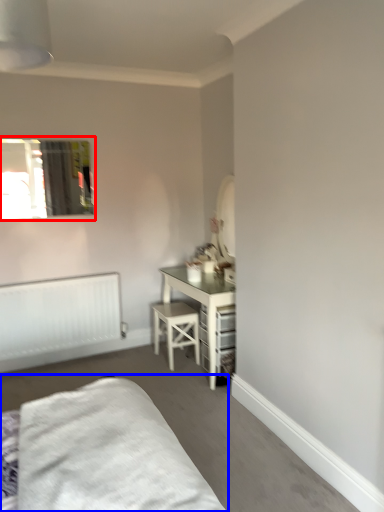
Question: Among these objects, which one is farthest to the camera, window (highlighted by a red box) or bed (highlighted by a blue box)?

Choices:
 (A) window
 (B) bed

Answer: (A)